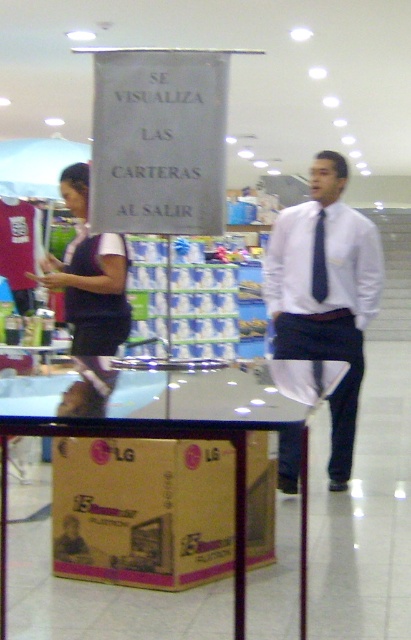
Can you confirm if gold cardboard lg tv box at center is smaller than black silk tie at center?

Incorrect, gold cardboard lg tv box at center is not smaller in size than black silk tie at center.

Between point (143, 561) and point (314, 288), which one is positioned behind?

The point (314, 288) is behind.

Identify the location of gold cardboard lg tv box at center. (143, 509).

Who is lower down, white satin dress shirt at center or black silk tie at center?

white satin dress shirt at center

Between white satin dress shirt at center and black silk tie at center, which one is positioned higher?

black silk tie at center is above.

The width and height of the screenshot is (411, 640). I want to click on white satin dress shirt at center, so click(x=325, y=262).

Find the location of a particular element. Image resolution: width=411 pixels, height=640 pixels. gold cardboard lg tv box at center is located at coordinates (143, 509).

Who is higher up, gold cardboard lg tv box at center or white satin dress shirt at center?

white satin dress shirt at center

This screenshot has width=411, height=640. Find the location of `gold cardboard lg tv box at center`. gold cardboard lg tv box at center is located at coordinates (143, 509).